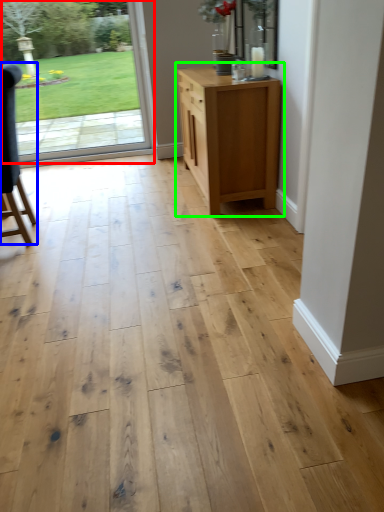
Question: Which object is positioned closest to door (highlighted by a red box)? Select from chair (highlighted by a blue box) and chest of drawers (highlighted by a green box).

Choices:
 (A) chair
 (B) chest of drawers

Answer: (A)